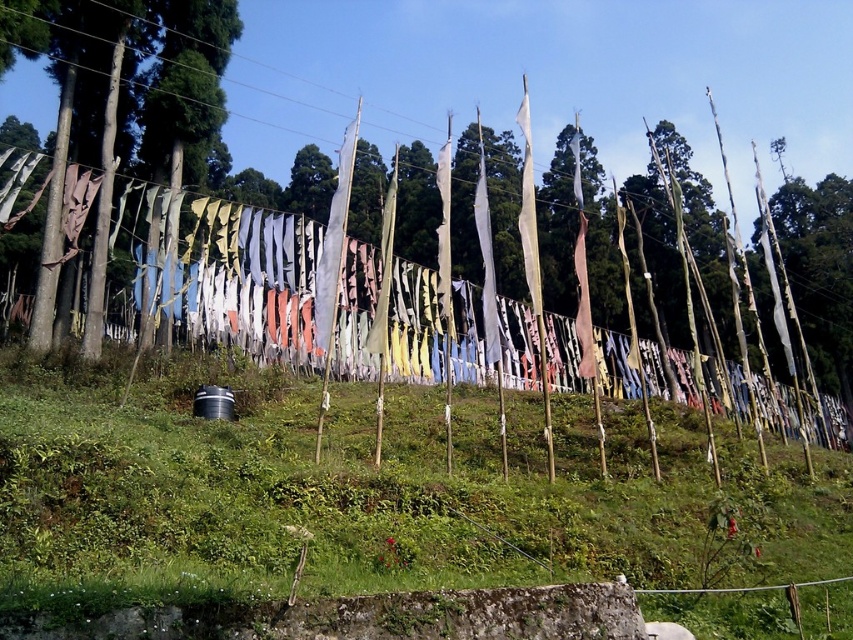
Who is taller, green grassy at center or green matte tree at left?

green matte tree at left is taller.

Find the location of a particular element. This screenshot has height=640, width=853. green grassy at center is located at coordinates (389, 500).

Based on the photo, between green grassy at center and green leafy tree at center, which one is positioned lower?

Positioned lower is green grassy at center.

Which is more to the left, green grassy at center or green leafy tree at center?

green grassy at center

Image resolution: width=853 pixels, height=640 pixels. In order to click on green grassy at center in this screenshot , I will do `click(389, 500)`.

Identify the location of green grassy at center. (389, 500).

Is green leafy tree at center wider than green matte tree at left?

Yes, green leafy tree at center is wider than green matte tree at left.

In the scene shown: Is green leafy tree at center bigger than green matte tree at left?

Yes.

The image size is (853, 640). Identify the location of green leafy tree at center. (550, 74).

This screenshot has width=853, height=640. In order to click on green leafy tree at center in this screenshot , I will do `click(550, 74)`.